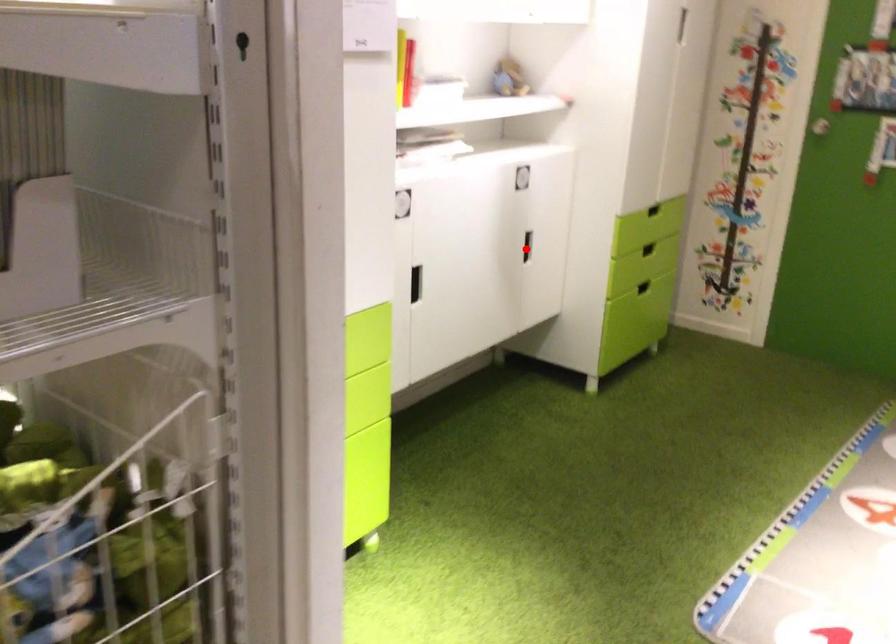
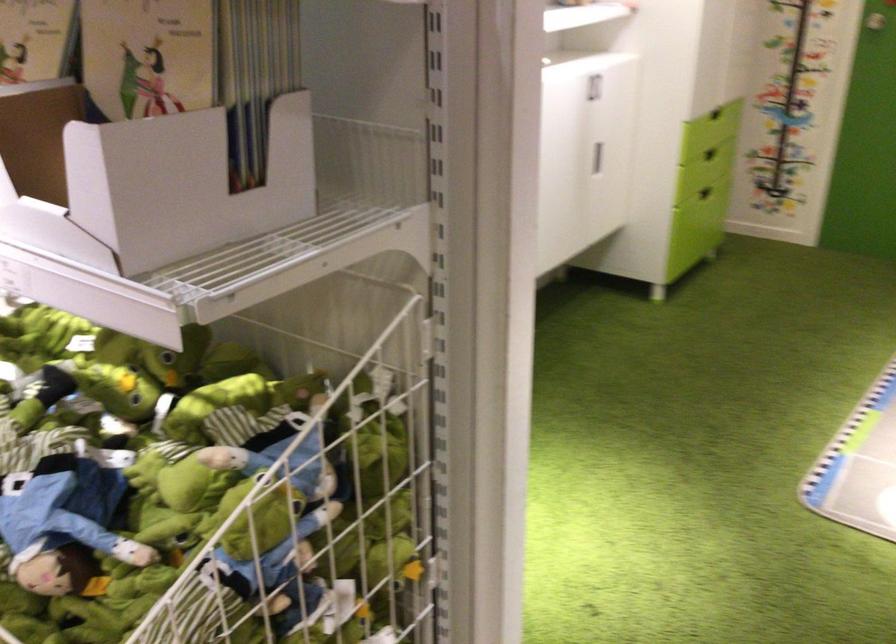
In the second image, find the point that corresponds to the highlighted location in the first image.

(597, 158)